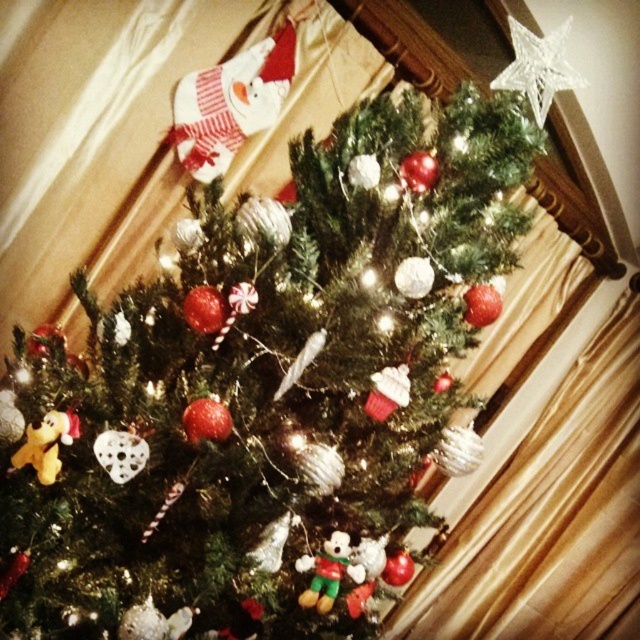
You are organizing a childrens Christmas party and need to place a small gift under the tree. The gift is 10 cm in height. You have two options for placement spots near the matte yellow plush bear at lower left and the multicolored fabric plush at center. Which spot would allow the gift to fit without being hidden?

The matte yellow plush bear at lower left has a smaller size compared to the multicolored fabric plush at center, so placing the gift near the matte yellow plush bear at lower left would allow it to be visible since the smaller plush bear is less likely to obscure the gift.

You are organizing the Christmas decorations and need to place the matte yellow plush bear at lower left and the multicolored fabric plush at center. According to the image, which decoration is positioned higher on the tree?

The matte yellow plush bear at lower left is located above the multicolored fabric plush at center, so the matte yellow plush bear at lower left is positioned higher on the tree.